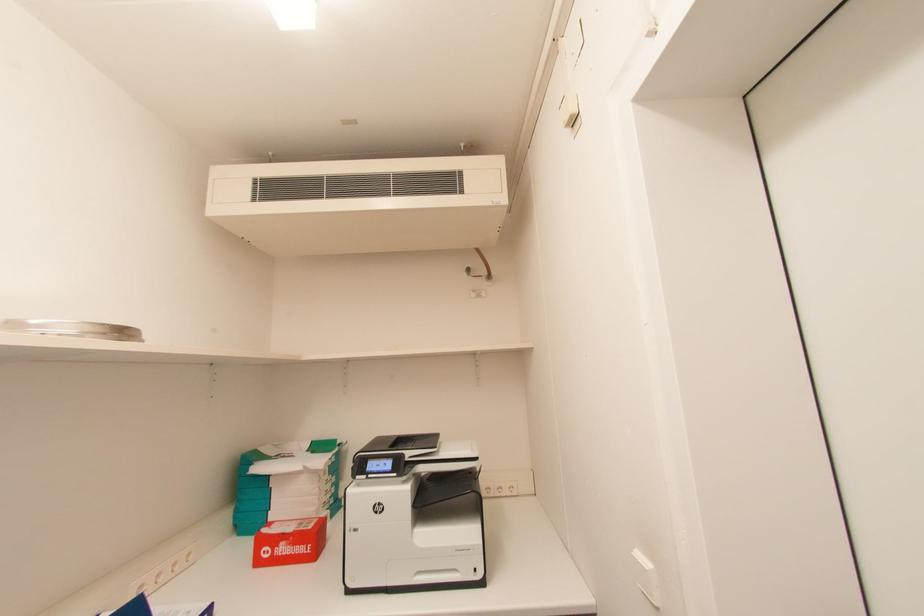
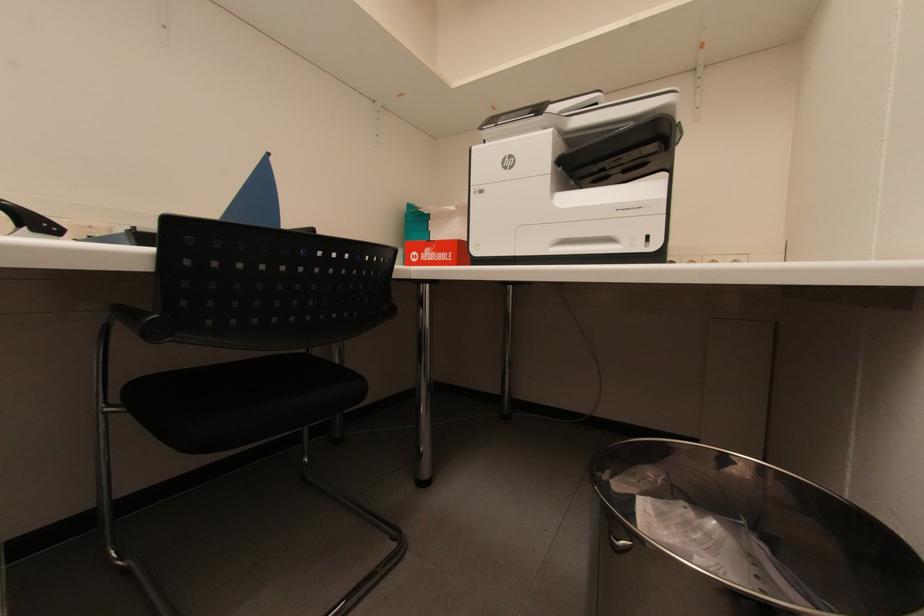
Question: How did the camera likely rotate?

Choices:
 (A) Left
 (B) Right
 (C) Up
 (D) Down

Answer: (A)